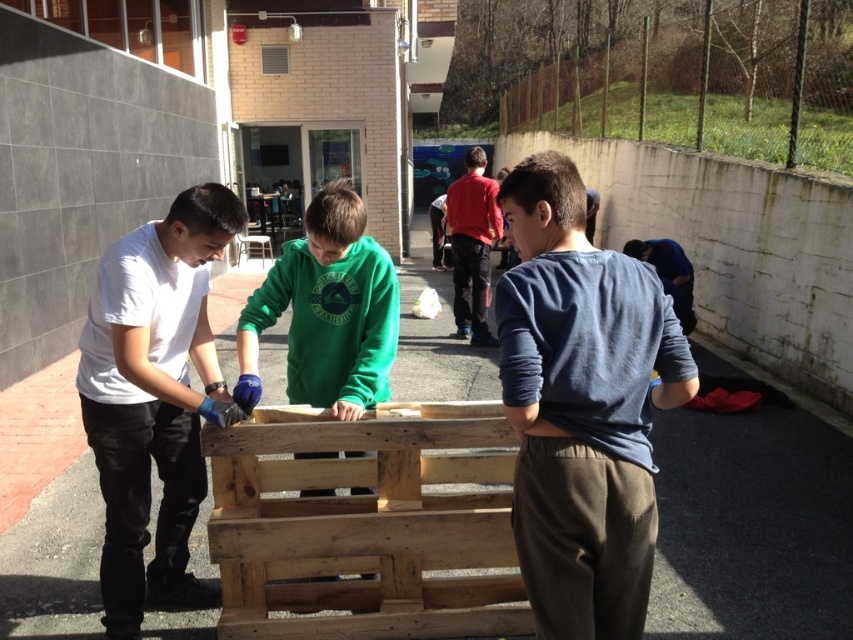
Who is more distant from viewer, (x=225, y=212) or (x=328, y=221)?

The point (x=328, y=221) is behind.

From the picture: Can you confirm if white matte shirt at left is shorter than green matte sweatshirt at center?

In fact, white matte shirt at left may be taller than green matte sweatshirt at center.

The height and width of the screenshot is (640, 853). In order to click on white matte shirt at left in this screenshot , I will do `click(154, 397)`.

Between point (630, 273) and point (154, 262), which one is positioned in front?

Point (630, 273) is more forward.

Is blue cotton shirt at center smaller than white matte shirt at left?

Indeed, blue cotton shirt at center has a smaller size compared to white matte shirt at left.

Is point (631, 429) behind point (136, 636)?

No.

This screenshot has height=640, width=853. I want to click on blue cotton shirt at center, so click(x=581, y=406).

Does point (628, 301) lie in front of point (390, 340)?

That is True.

Does blue cotton shirt at center have a lesser height compared to green matte sweatshirt at center?

No.

Between point (625, 404) and point (341, 260), which one is positioned behind?

Point (341, 260)

Identify the location of blue cotton shirt at center. (581, 406).